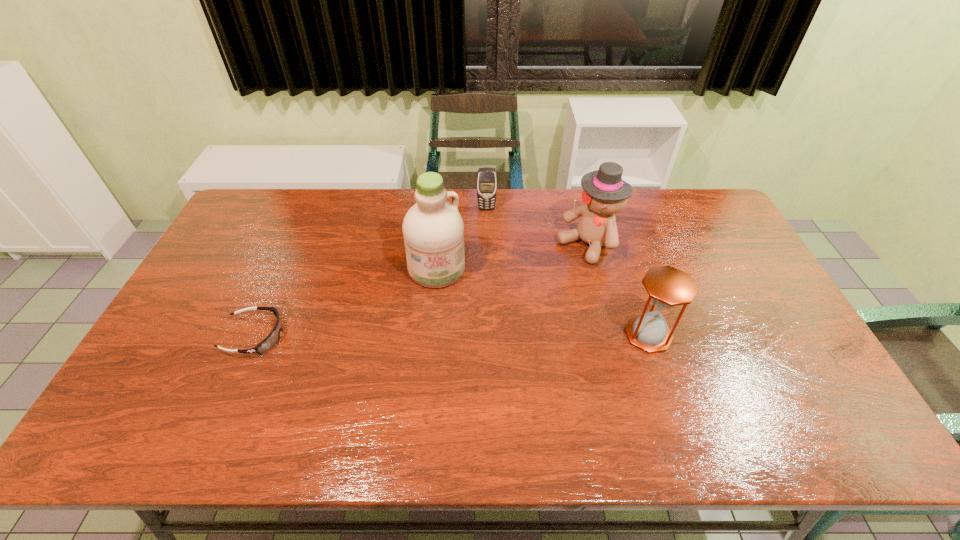
This screenshot has height=540, width=960. What are the coordinates of `vacant spot on the desktop that is between the goggles and the hourglass and is positioned on the front face of the farthest object` in the screenshot? It's located at coord(492,335).

You are a GUI agent. You are given a task and a screenshot of the screen. Output one action in this format:
    pyautogui.click(x=<x>, y=<y>)
    Task: Click on the vacant space on the desktop that is between the shortest object and the hourglass and is positioned on the front label of the tallest object
    
    Given the screenshot: What is the action you would take?
    pyautogui.click(x=457, y=335)

The width and height of the screenshot is (960, 540). In order to click on free spot on the desktop that is between the leftmost object and the third tallest object and is positioned on the front-facing side of the second tallest object in this screenshot , I will do `click(470, 335)`.